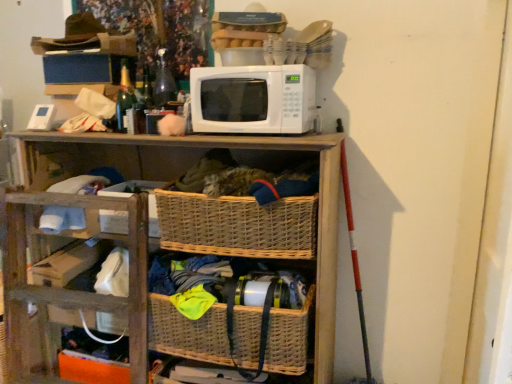
Question: Does green glass bottle at upper left have a greater height compared to woven wood shelf at center?

Choices:
 (A) yes
 (B) no

Answer: (B)

Question: Would you consider green glass bottle at upper left to be distant from woven wood shelf at center?

Choices:
 (A) no
 (B) yes

Answer: (A)

Question: From a real-world perspective, is green glass bottle at upper left over woven wood shelf at center?

Choices:
 (A) yes
 (B) no

Answer: (A)

Question: Does green glass bottle at upper left have a lesser height compared to woven wood shelf at center?

Choices:
 (A) no
 (B) yes

Answer: (B)

Question: Is green glass bottle at upper left bigger than woven wood shelf at center?

Choices:
 (A) no
 (B) yes

Answer: (A)

Question: Which is correct: white matte microwave at upper center is inside blue cardboard box at upper left, which appears as the second storage box when ordered from the bottom, or outside of it?

Choices:
 (A) inside
 (B) outside

Answer: (B)

Question: Considering the positions of white matte microwave at upper center and blue cardboard box at upper left, which appears as the second storage box when ordered from the bottom, in the image, is white matte microwave at upper center taller or shorter than blue cardboard box at upper left, which appears as the second storage box when ordered from the bottom,?

Choices:
 (A) short
 (B) tall

Answer: (B)

Question: Would you say white matte microwave at upper center is to the left or to the right of blue cardboard box at upper left, the first storage box when ordered from top to bottom, in the picture?

Choices:
 (A) left
 (B) right

Answer: (B)

Question: Does point (243, 89) appear closer or farther from the camera than point (91, 69)?

Choices:
 (A) farther
 (B) closer

Answer: (B)

Question: Considering their positions, is woven basket at center located in front of or behind woven brown basket at center, which is the 2th basket from bottom to top?

Choices:
 (A) front
 (B) behind

Answer: (A)

Question: In terms of size, does woven basket at center appear bigger or smaller than woven brown basket at center, which is the 2th basket from bottom to top?

Choices:
 (A) small
 (B) big

Answer: (A)

Question: Does point (309, 173) appear closer or farther from the camera than point (161, 226)?

Choices:
 (A) farther
 (B) closer

Answer: (B)

Question: From the image's perspective, is woven basket at center above or below woven brown basket at center, which is the 2th basket from bottom to top?

Choices:
 (A) above
 (B) below

Answer: (A)

Question: Considering the positions of point (110, 213) and point (59, 162), is point (110, 213) closer or farther from the camera than point (59, 162)?

Choices:
 (A) farther
 (B) closer

Answer: (B)

Question: Is white cardboard box at center, the 2th storage box from the top, bigger or smaller than woven wood shelf at center?

Choices:
 (A) small
 (B) big

Answer: (A)